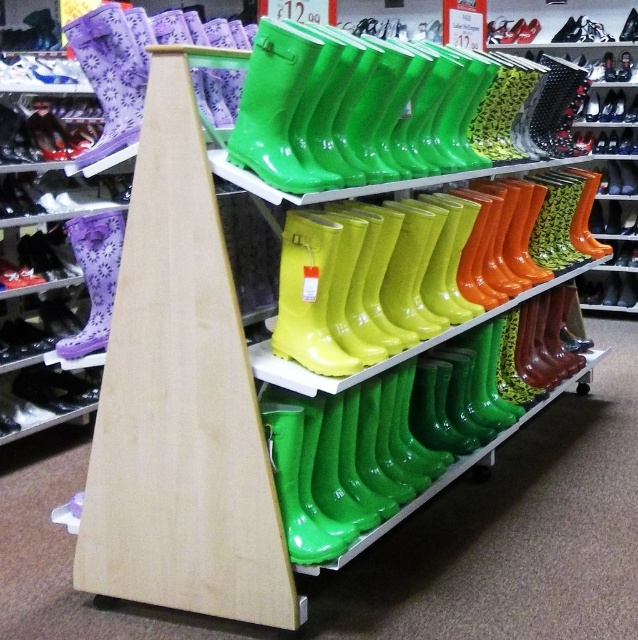
Where is `glossy rubber boots at center`? This screenshot has height=640, width=638. glossy rubber boots at center is located at coordinates (417, 268).

Is glossy rubber boots at center smaller than matte black shoe at lower left?

No, glossy rubber boots at center is not smaller than matte black shoe at lower left.

Between point (315, 224) and point (33, 381), which one is positioned behind?

The point (33, 381) is more distant.

What are the coordinates of `glossy rubber boots at center` in the screenshot? It's located at (417, 268).